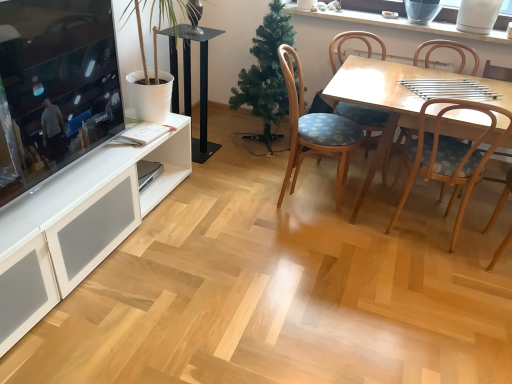
Image resolution: width=512 pixels, height=384 pixels. Find the location of `white ceramic vase at upper center`. white ceramic vase at upper center is located at coordinates (402, 24).

What do you see at coordinates (190, 83) in the screenshot?
I see `black glass speaker at center` at bounding box center [190, 83].

Identify the location of blue fabric chair at center, which appears as the 4th chair when viewed from the right. coord(314,129).

The height and width of the screenshot is (384, 512). In order to click on wooden chair with blue cushion at center-right, the 3th chair viewed from the left in this screenshot , I will do `click(449, 156)`.

You are a GUI agent. You are given a task and a screenshot of the screen. Output one action in this format:
    pyautogui.click(x=<x>, y=<y>)
    Task: Click on the green matte christmas tree at center
    
    Given the screenshot: What is the action you would take?
    pyautogui.click(x=266, y=75)

In the scene shown: Is matte black television at left with wooden chair with blue cushion at center-right, the 3th chair viewed from the left?

No.

Considering the positions of objects matte black television at left and wooden chair with blue cushion at center-right, which is the second chair from right to left, in the image provided, who is behind, matte black television at left or wooden chair with blue cushion at center-right, which is the second chair from right to left,?

Positioned behind is wooden chair with blue cushion at center-right, which is the second chair from right to left.

Can you confirm if matte black television at left is taller than wooden chair with blue cushion at center-right, the 3th chair viewed from the left?

Incorrect, the height of matte black television at left is not larger of that of wooden chair with blue cushion at center-right, the 3th chair viewed from the left.

In the scene shown: How distant is matte black television at left from wooden chair with blue cushion at center-right, which is the second chair from right to left?

5.46 feet.

Considering the positions of objects blue fabric chair at center, positioned as the first chair in left-to-right order, and black glass speaker at center in the image provided, who is more to the left, blue fabric chair at center, positioned as the first chair in left-to-right order, or black glass speaker at center?

black glass speaker at center is more to the left.

Which point is more forward, (300, 86) or (170, 50)?

The point (300, 86) is closer to the camera.

Is blue fabric chair at center, which appears as the 4th chair when viewed from the right, positioned with its back to black glass speaker at center?

Yes.

Who is shorter, white ceramic vase at upper center or light wood table at center?

white ceramic vase at upper center.

Is white ceramic vase at upper center to the left of light wood table at center from the viewer's perspective?

Indeed, white ceramic vase at upper center is positioned on the left side of light wood table at center.

From a real-world perspective, between white ceramic vase at upper center and light wood table at center, who is vertically higher?

white ceramic vase at upper center is physically above.

Is the surface of white ceramic vase at upper center in direct contact with light wood table at center?

No, white ceramic vase at upper center is not touching light wood table at center.

Does point (240, 75) lie in front of point (357, 131)?

That is False.

Is blue fabric chair at center, which appears as the 4th chair when viewed from the right, located within green matte christmas tree at center?

That's incorrect, blue fabric chair at center, which appears as the 4th chair when viewed from the right, is not inside green matte christmas tree at center.

Does green matte christmas tree at center have a lesser height compared to blue fabric chair at center, positioned as the first chair in left-to-right order?

No.

From a real-world perspective, is wooden chair with blue cushion at center-right, the 3th chair viewed from the left, under matte black television at left?

Indeed, from a real-world perspective, wooden chair with blue cushion at center-right, the 3th chair viewed from the left, is positioned beneath matte black television at left.

From the image's perspective, which is below, wooden chair with blue cushion at center-right, which is the second chair from right to left, or matte black television at left?

wooden chair with blue cushion at center-right, which is the second chair from right to left, from the image's perspective.

Is wooden chair with blue cushion at center-right, the 3th chair viewed from the left, facing towards matte black television at left?

No, wooden chair with blue cushion at center-right, the 3th chair viewed from the left, is not oriented towards matte black television at left.

Visually, is light wood table at center positioned to the left or to the right of wooden chair with floral cushion at center, which is the 2th chair in left-to-right order?

Based on their positions, light wood table at center is located to the right of wooden chair with floral cushion at center, which is the 2th chair in left-to-right order.

Is light wood table at center taller or shorter than wooden chair with floral cushion at center, which ranks as the 3th chair in right-to-left order?

Clearly, light wood table at center is shorter compared to wooden chair with floral cushion at center, which ranks as the 3th chair in right-to-left order.

From a real-world perspective, which is physically below, light wood table at center or wooden chair with floral cushion at center, which is the 2th chair in left-to-right order?

→ light wood table at center.

Is black glass speaker at center oriented away from light wood table at center?

No, light wood table at center is not at the back of black glass speaker at center.

Is black glass speaker at center not near light wood table at center?

Yes.

Which of these two, black glass speaker at center or light wood table at center, stands taller?

black glass speaker at center.

From a real-world perspective, is black glass speaker at center under light wood table at center?

No.

Image resolution: width=512 pixels, height=384 pixels. I want to click on chair that is the 2nd object located below the matte black television at left (from the image's perspective), so click(449, 156).

Where is `side table above the blue fabric chair at center, which appears as the 4th chair when viewed from the right (from the image's perspective)`? Image resolution: width=512 pixels, height=384 pixels. side table above the blue fabric chair at center, which appears as the 4th chair when viewed from the right (from the image's perspective) is located at coordinates (190, 83).

When comparing their distances from wooden chair with blue cushion at center-right, the 3th chair viewed from the left, does black glass speaker at center or matte black television at left seem closer?

black glass speaker at center.

From the image, which object appears to be farther from blue fabric chair at center, which appears as the 4th chair when viewed from the right, light wood table at center or green matte christmas tree at center?

green matte christmas tree at center.

From the image, which object appears to be farther from blue fabric chair at center, which appears as the 4th chair when viewed from the right, wooden chair with floral cushion at center, the 1th chair when ordered from right to left, or matte black television at left?

matte black television at left is further to blue fabric chair at center, which appears as the 4th chair when viewed from the right.

Estimate the real-world distances between objects in this image. Which object is further from black glass speaker at center, wooden chair with blue cushion at center-right, the 3th chair viewed from the left, or blue fabric chair at center, positioned as the first chair in left-to-right order?

wooden chair with blue cushion at center-right, the 3th chair viewed from the left, is further to black glass speaker at center.

Considering their positions, is blue fabric chair at center, positioned as the first chair in left-to-right order, positioned closer to matte black television at left than wooden chair with blue cushion at center-right, which is the second chair from right to left?

Among the two, blue fabric chair at center, positioned as the first chair in left-to-right order, is located nearer to matte black television at left.

Based on their spatial positions, is black glass speaker at center or matte black television at left further from white ceramic vase at upper center?

matte black television at left.

Estimate the real-world distances between objects in this image. Which object is further from green matte christmas tree at center, blue fabric chair at center, positioned as the first chair in left-to-right order, or wooden chair with floral cushion at center, which ranks as the 3th chair in right-to-left order?

wooden chair with floral cushion at center, which ranks as the 3th chair in right-to-left order, is positioned further to the anchor green matte christmas tree at center.

From the image, which object appears to be farther from matte black television at left, wooden chair with blue cushion at center-right, which is the second chair from right to left, or white ceramic vase at upper center?

The object further to matte black television at left is white ceramic vase at upper center.

At what (x,y) coordinates should I click in order to perform the action: click on christmas tree between matte black television at left and wooden chair with floral cushion at center, which is the 2th chair in left-to-right order. Please return your answer as a coordinate pair (x, y). This screenshot has height=384, width=512. Looking at the image, I should click on (266, 75).

This screenshot has height=384, width=512. Find the location of `side table located between matte black television at left and wooden chair with blue cushion at center-right, which is the second chair from right to left, in the left-right direction`. side table located between matte black television at left and wooden chair with blue cushion at center-right, which is the second chair from right to left, in the left-right direction is located at coordinates (190, 83).

Find the location of `kitchen & dining room table between white ceramic vase at upper center and wooden chair with blue cushion at center-right, the 3th chair viewed from the left, from top to bottom`. kitchen & dining room table between white ceramic vase at upper center and wooden chair with blue cushion at center-right, the 3th chair viewed from the left, from top to bottom is located at coordinates (381, 100).

Image resolution: width=512 pixels, height=384 pixels. What are the coordinates of `christmas tree between black glass speaker at center and light wood table at center in the horizontal direction` in the screenshot? It's located at (266, 75).